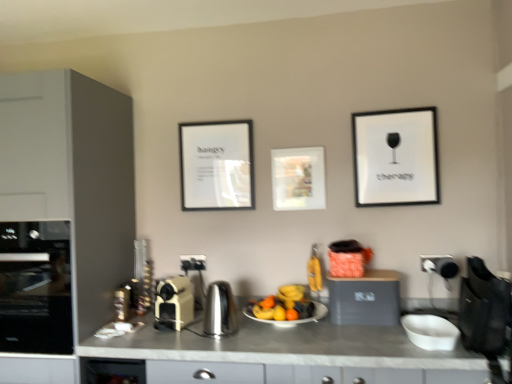
Identify the location of vacant space underneath white matte bowl at lower right (from a real-world perspective). Image resolution: width=512 pixels, height=384 pixels. pos(424,336).